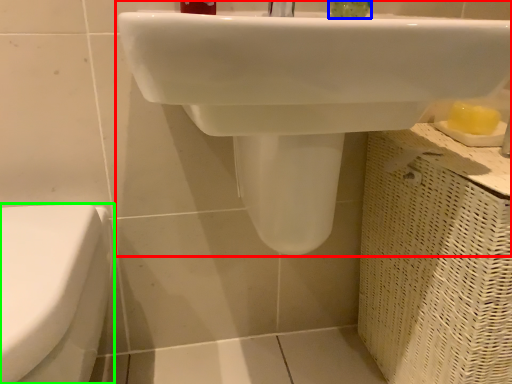
Question: Which object is the closest to the sink (highlighted by a red box)? Choose among these: liquid (highlighted by a blue box) or toilet (highlighted by a green box).

Choices:
 (A) liquid
 (B) toilet

Answer: (B)